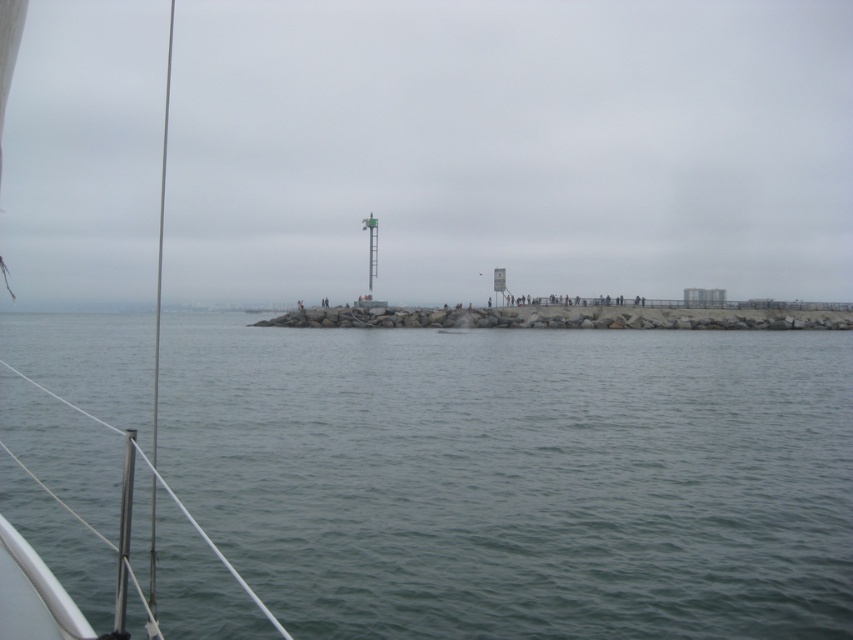
Question: Does gray matte water at center have a lesser width compared to gray concrete pier at center?

Choices:
 (A) no
 (B) yes

Answer: (B)

Question: Which object is closer to the camera taking this photo?

Choices:
 (A) white matte boat at center
 (B) gray concrete pier at center

Answer: (A)

Question: Can you confirm if gray matte water at center is smaller than white matte boat at center?

Choices:
 (A) yes
 (B) no

Answer: (B)

Question: From the image, what is the correct spatial relationship of gray concrete pier at center in relation to white matte boat at center?

Choices:
 (A) above
 (B) below

Answer: (A)

Question: Which point appears closest to the camera in this image?

Choices:
 (A) (42, 1)
 (B) (392, 545)

Answer: (B)

Question: Which point is farther from the camera taking this photo?

Choices:
 (A) (405, 586)
 (B) (276, 154)
 (C) (4, 100)

Answer: (B)